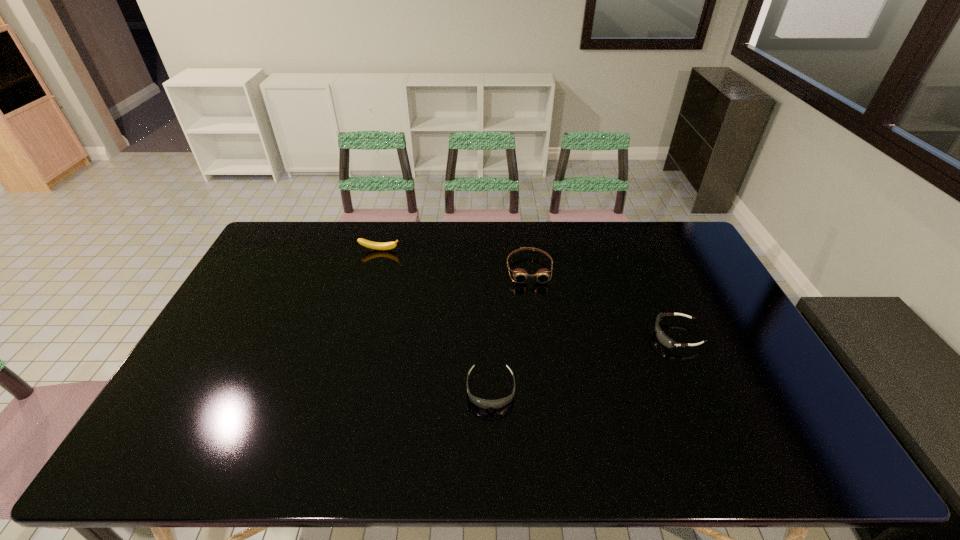
Locate an element on the screen. free spot located 0.120m on the lenses of the second object from left to right is located at coordinates (492, 458).

Find the location of a particular element. vacant space situated on the front and sides of the third farthest object is located at coordinates (538, 335).

Where is `vacant position located on the front and sides of the third farthest object`? vacant position located on the front and sides of the third farthest object is located at coordinates (528, 335).

Locate an element on the screen. The image size is (960, 540). free space located 0.270m on the front and sides of the third farthest object is located at coordinates (562, 335).

At what (x,y) coordinates should I click in order to perform the action: click on banana that is at the far edge. Please return your answer as a coordinate pair (x, y). Looking at the image, I should click on (366, 243).

In order to click on goggles positioned at the far edge in this screenshot , I will do `click(520, 275)`.

Locate an element on the screen. object that is at the right edge is located at coordinates (661, 336).

In the image, there is a desktop. Find the location of `vacant space at the far edge`. vacant space at the far edge is located at coordinates (334, 251).

In the image, there is a desktop. Where is `free space at the near edge`? The image size is (960, 540). free space at the near edge is located at coordinates (732, 468).

The image size is (960, 540). What are the coordinates of `vacant region at the left edge of the desktop` in the screenshot? It's located at (281, 289).